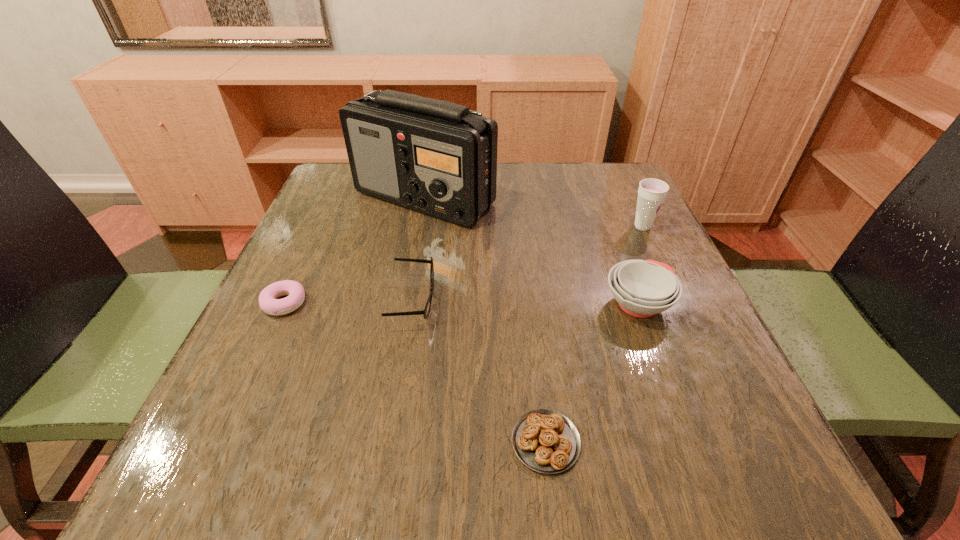
What are the coordinates of `free space that satisfies the following two spatial constraints: 1. on the front side of the shortest object; 2. on the right side of the leftmost object` in the screenshot? It's located at (220, 442).

In order to click on free spot that satisfies the following two spatial constraints: 1. on the front panel of the tallest object; 2. on the left side of the nearest object in this screenshot , I will do `click(382, 442)`.

Locate an element on the screen. The width and height of the screenshot is (960, 540). free location that satisfies the following two spatial constraints: 1. on the front panel of the radio receiver; 2. on the left side of the second tallest object is located at coordinates (420, 226).

Find the location of a particular element. free spot that satisfies the following two spatial constraints: 1. on the front-facing side of the soup bowl; 2. on the left side of the third shortest object is located at coordinates (413, 304).